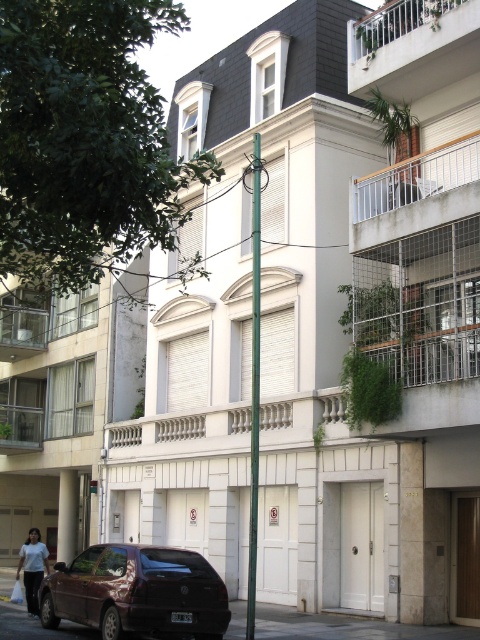
You are standing in front of the residential building and see a point marked at coordinates (136, 593). What object is located at that point?

The point at coordinates (136, 593) corresponds to the shiny maroon hatchback at lower left.

You are a delivery person arriving at the building and need to park your shiny maroon hatchback at lower left. The white metal railing at upper center is in the way. Can you move your vehicle to the right to avoid it?

The shiny maroon hatchback at lower left is positioned on the left side of the white metal railing at upper center. Moving it to the right would place it closer to the railing, so you cannot avoid it by moving right.